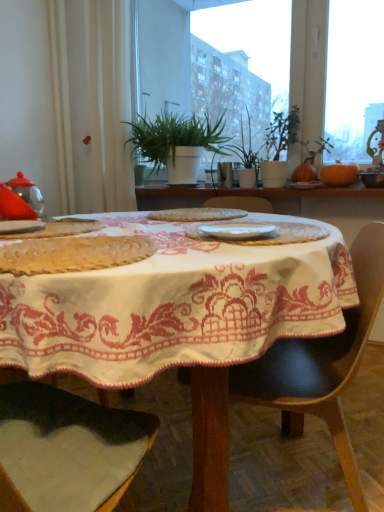
This screenshot has width=384, height=512. Find the location of `transparent glass teapot at left, marked as the fifth tableware in a right-to-left arrangement`. transparent glass teapot at left, marked as the fifth tableware in a right-to-left arrangement is located at coordinates (20, 199).

This screenshot has width=384, height=512. What do you see at coordinates (20, 226) in the screenshot? I see `white matte plate at left, the second tableware positioned from the left` at bounding box center [20, 226].

Measure the distance between point (170, 334) and camera.

Point (170, 334) and camera are 76.10 centimeters apart from each other.

The image size is (384, 512). I want to click on matte ceramic bowl at upper right, the 4th tableware positioned from the front, so click(373, 178).

At what (x,y) coordinates should I click in order to perform the action: click on green matte plant at center, the first houseplant from the right. Please return your answer as a coordinate pair (x, y). The height and width of the screenshot is (512, 384). Looking at the image, I should click on (245, 157).

Describe the element at coordinates (245, 157) in the screenshot. This screenshot has height=512, width=384. I see `green matte plant at center, which is counted as the 2th houseplant, starting from the left` at that location.

The height and width of the screenshot is (512, 384). Describe the element at coordinates (270, 67) in the screenshot. I see `green leafy plants at upper center` at that location.

Locate an element on the screen. The width and height of the screenshot is (384, 512). green leafy plant at center, positioned as the second houseplant in right-to-left order is located at coordinates (177, 142).

At what (x,y) coordinates should I click in order to perform the action: click on the 2nd houseplant positioned above the white matte plate at left, which is counted as the fourth tableware, starting from the back (from a real-world perspective). Please return your answer as a coordinate pair (x, y). Image resolution: width=384 pixels, height=512 pixels. Looking at the image, I should click on (177, 142).

Measure the distance between white matte plate at left, which ranks as the fourth tableware in top-to-bottom order, and green leafy plant at center, positioned as the second houseplant in right-to-left order.

white matte plate at left, which ranks as the fourth tableware in top-to-bottom order, and green leafy plant at center, positioned as the second houseplant in right-to-left order, are 1.31 meters apart.

From the picture: Considering the sizes of white matte plate at left, which is counted as the fourth tableware, starting from the back, and green leafy plant at center, the first houseplant when ordered from left to right, in the image, is white matte plate at left, which is counted as the fourth tableware, starting from the back, bigger or smaller than green leafy plant at center, the first houseplant when ordered from left to right,?

white matte plate at left, which is counted as the fourth tableware, starting from the back, is smaller than green leafy plant at center, the first houseplant when ordered from left to right.

Locate an element on the screen. The width and height of the screenshot is (384, 512). window screen located above the black leather chair at center (from the image's perspective) is located at coordinates (270, 67).

Between green leafy plants at upper center and black leather chair at center, which one has larger width?

black leather chair at center is wider.

Considering the relative sizes of green leafy plants at upper center and black leather chair at center in the image provided, is green leafy plants at upper center shorter than black leather chair at center?

Incorrect, the height of green leafy plants at upper center does not fall short of that of black leather chair at center.

Which object is positioned more to the left, green leafy plants at upper center or black leather chair at center?

From the viewer's perspective, black leather chair at center appears more on the left side.

Considering the positions of point (215, 231) and point (376, 186), is point (215, 231) closer or farther from the camera than point (376, 186)?

Point (215, 231).

What's the angular difference between white glossy plate at center, which is counted as the 3th tableware, starting from the left, and matte ceramic bowl at upper right, the 4th tableware positioned from the front,'s facing directions?

13.7 degrees.

From the image's perspective, is white glossy plate at center, the third tableware viewed from the right, located beneath matte ceramic bowl at upper right, positioned as the 5th tableware in bottom-to-top order?

Yes.

Does white glossy plate at center, the third tableware viewed from the right, touch matte ceramic bowl at upper right, the 4th tableware positioned from the front?

There is a gap between white glossy plate at center, the third tableware viewed from the right, and matte ceramic bowl at upper right, the 4th tableware positioned from the front.

This screenshot has height=512, width=384. I want to click on table in front of the green matte plant at center, the first houseplant from the right, so click(x=173, y=307).

Can you confirm if white embroidered tablecloth at center is wider than green matte plant at center, the first houseplant from the right?

Yes, white embroidered tablecloth at center is wider than green matte plant at center, the first houseplant from the right.

Could you tell me if white embroidered tablecloth at center is facing green matte plant at center, the first houseplant from the right?

No, white embroidered tablecloth at center is not facing towards green matte plant at center, the first houseplant from the right.

Is white embroidered tablecloth at center smaller than green matte plant at center, the first houseplant from the right?

Incorrect, white embroidered tablecloth at center is not smaller in size than green matte plant at center, the first houseplant from the right.

Is orange matte pumpkin at upper right completely or partially outside of matte ceramic bowl at upper right, positioned as the 5th tableware in left-to-right order?

That's correct, orange matte pumpkin at upper right is outside of matte ceramic bowl at upper right, positioned as the 5th tableware in left-to-right order.

Identify the location of the 1st tableware positioned below the orange matte pumpkin at upper right (from the image's perspective). 373,178.

Which object is wider, orange matte pumpkin at upper right or matte ceramic bowl at upper right, which is the first tableware from top to bottom?

orange matte pumpkin at upper right is wider.

Which point is more distant from viewer, (332, 168) or (371, 170)?

Positioned behind is point (332, 168).

Does white matte plate at left, positioned as the 2th tableware in front-to-back order, appear on the right side of white glossy plate at center, which is the 1th tableware from bottom to top?

Incorrect, white matte plate at left, positioned as the 2th tableware in front-to-back order, is not on the right side of white glossy plate at center, which is the 1th tableware from bottom to top.

Who is more distant, white matte plate at left, which ranks as the fourth tableware in top-to-bottom order, or white glossy plate at center, which is counted as the 3th tableware, starting from the left?

Positioned behind is white matte plate at left, which ranks as the fourth tableware in top-to-bottom order.

Is white matte plate at left, placed as the 2th tableware when sorted from bottom to top, facing towards white glossy plate at center, the 5th tableware from the back?

No, white matte plate at left, placed as the 2th tableware when sorted from bottom to top, does not turn towards white glossy plate at center, the 5th tableware from the back.

From their relative heights in the image, would you say white matte plate at left, which is counted as the fourth tableware, starting from the back, is taller or shorter than white glossy plate at center, which is the 1th tableware from bottom to top?

Considering their sizes, white matte plate at left, which is counted as the fourth tableware, starting from the back, has more height than white glossy plate at center, which is the 1th tableware from bottom to top.

In the scene shown: Can you confirm if green leafy plants at upper center is positioned to the left of orange matte pumpkin at upper right?

Indeed, green leafy plants at upper center is positioned on the left side of orange matte pumpkin at upper right.

The height and width of the screenshot is (512, 384). What are the coordinates of `window screen in front of the orange matte pumpkin at upper right` in the screenshot? It's located at (270, 67).

Based on the photo, are green leafy plants at upper center and orange matte pumpkin at upper right beside each other?

No, green leafy plants at upper center is not next to orange matte pumpkin at upper right.

How many degrees apart are the facing directions of green leafy plants at upper center and orange matte pumpkin at upper right?

There is a 0.00161-degree angle between the facing directions of green leafy plants at upper center and orange matte pumpkin at upper right.

Locate an element on the screen. The image size is (384, 512). houseplant that is the 2nd one when counting upward from the white matte plate at left, positioned as the 2th tableware in front-to-back order (from the image's perspective) is located at coordinates (177, 142).

Image resolution: width=384 pixels, height=512 pixels. I want to click on chair in front of the green leafy plants at upper center, so click(x=288, y=385).

Considering their positions, is transparent glass teapot at left, marked as the fifth tableware in a right-to-left arrangement, positioned further to orange matte pumpkin at upper right than white embroidered tablecloth at center?

transparent glass teapot at left, marked as the fifth tableware in a right-to-left arrangement, is further to orange matte pumpkin at upper right.

Consider the image. From the image, which object appears to be farther from green leafy plant at center, the first houseplant when ordered from left to right, white matte plate at left, placed as the 2th tableware when sorted from bottom to top, or transparent glass teapot at left, the 3th tableware in the front-to-back sequence?

The object further to green leafy plant at center, the first houseplant when ordered from left to right, is white matte plate at left, placed as the 2th tableware when sorted from bottom to top.

In the scene shown: Estimate the real-world distances between objects in this image. Which object is closer to green matte plant at center, the first houseplant from the right, transparent glass teapot at left, positioned as the third tableware in back-to-front order, or green leafy plants at upper center?

green leafy plants at upper center is closer to green matte plant at center, the first houseplant from the right.

From the image, which object appears to be nearer to white glossy plate at center, the 5th tableware from the back, orange matte pumpkin at upper right or green matte plant at center, the first houseplant from the right?

orange matte pumpkin at upper right lies closer to white glossy plate at center, the 5th tableware from the back, than the other object.

From the image, which object appears to be nearer to white embroidered tablecloth at center, transparent glass teapot at left, arranged as the third tableware when ordered from the bottom, or green leafy plants at upper center?

transparent glass teapot at left, arranged as the third tableware when ordered from the bottom, is closer to white embroidered tablecloth at center.

Based on the photo, from the image, which object appears to be farther from transparent glass teapot at left, the 3th tableware in the top-to-bottom sequence, matte ceramic bowl at upper right, the first tableware positioned from the right, or matte white plate at center, which is the fourth tableware in left-to-right order?

The object further to transparent glass teapot at left, the 3th tableware in the top-to-bottom sequence, is matte ceramic bowl at upper right, the first tableware positioned from the right.

Based on their spatial positions, is green matte plant at center, which is counted as the 2th houseplant, starting from the left, or white glossy plate at center, which is the 1th tableware from bottom to top, closer to green leafy plant at center, the first houseplant when ordered from left to right?

green matte plant at center, which is counted as the 2th houseplant, starting from the left, is positioned closer to the anchor green leafy plant at center, the first houseplant when ordered from left to right.

Considering their positions, is green leafy plant at center, the first houseplant when ordered from left to right, positioned closer to orange matte pumpkin at upper right than white matte plate at left, the 4th tableware from the right?

Among the two, green leafy plant at center, the first houseplant when ordered from left to right, is located nearer to orange matte pumpkin at upper right.

Find the location of a particular element. window screen located between white glossy plate at center, which is the first tableware in front-to-back order, and green leafy plant at center, positioned as the second houseplant in right-to-left order, in the depth direction is located at coordinates (270, 67).

The image size is (384, 512). Identify the location of window screen located between transparent glass teapot at left, the 3th tableware in the front-to-back sequence, and orange matte pumpkin at upper right in the left-right direction. (270, 67).

What are the coordinates of `pumpkin between white embroidered tablecloth at center and matte white plate at center, acting as the fourth tableware starting from the bottom, from front to back` in the screenshot? It's located at (339, 174).

The image size is (384, 512). In order to click on chair positioned between white embroidered tablecloth at center and orange matte pumpkin at upper right from near to far in this screenshot , I will do `click(288, 385)`.